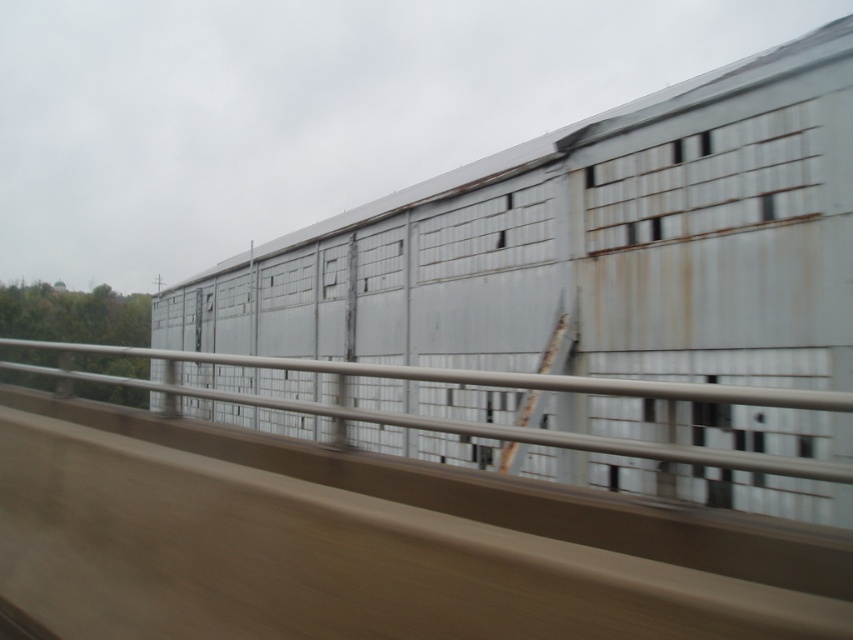
Question: Is rusty metal train at center thinner than satin silver rail at center?

Choices:
 (A) yes
 (B) no

Answer: (A)

Question: Is rusty metal train at center to the right of satin silver rail at center from the viewer's perspective?

Choices:
 (A) no
 (B) yes

Answer: (B)

Question: Among these objects, which one is farthest from the camera?

Choices:
 (A) satin silver rail at center
 (B) rusty metal train at center

Answer: (B)

Question: Is the position of rusty metal train at center more distant than that of satin silver rail at center?

Choices:
 (A) no
 (B) yes

Answer: (B)

Question: Which point is farther to the camera?

Choices:
 (A) satin silver rail at center
 (B) rusty metal train at center

Answer: (B)

Question: Among these objects, which one is farthest from the camera?

Choices:
 (A) rusty metal train at center
 (B) satin silver rail at center

Answer: (A)